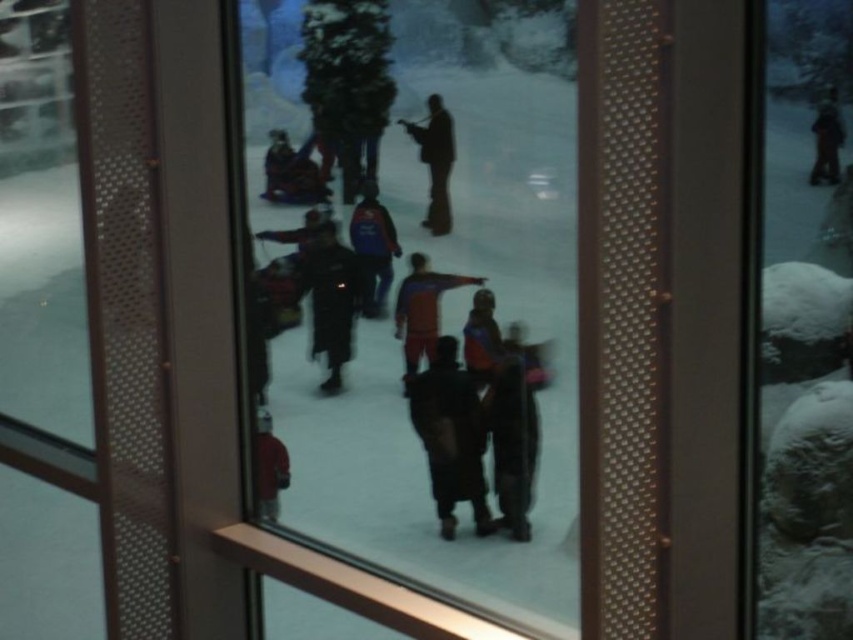
You are designing a new coat rack for a small entryway. The dark brown leather pants at center and orange fabric jacket at center need to be hung side by side. Given their widths, which one should be placed on the narrower hanger to ensure both fit properly?

The dark brown leather pants at center has a lesser width compared to the orange fabric jacket at center, so the dark brown leather pants at center should be placed on the narrower hanger to accommodate both items properly.

From the picture: You are looking at the scene through the window. There are two jackets at the center of the image, a dark blue jacket at center and a velvet blue jacket at center. Which one is closer to the window?

The dark blue jacket at center is located below the velvet blue jacket at center, so it is closer to the window.

You are a tailor who needs to compare the sizes of two jackets in the scene. The jackets are the dark blue fabric jacket at center and the matte red jacket at lower left. Which jacket is wider?

The dark blue fabric jacket at center is wider than the matte red jacket at lower left according to the description.